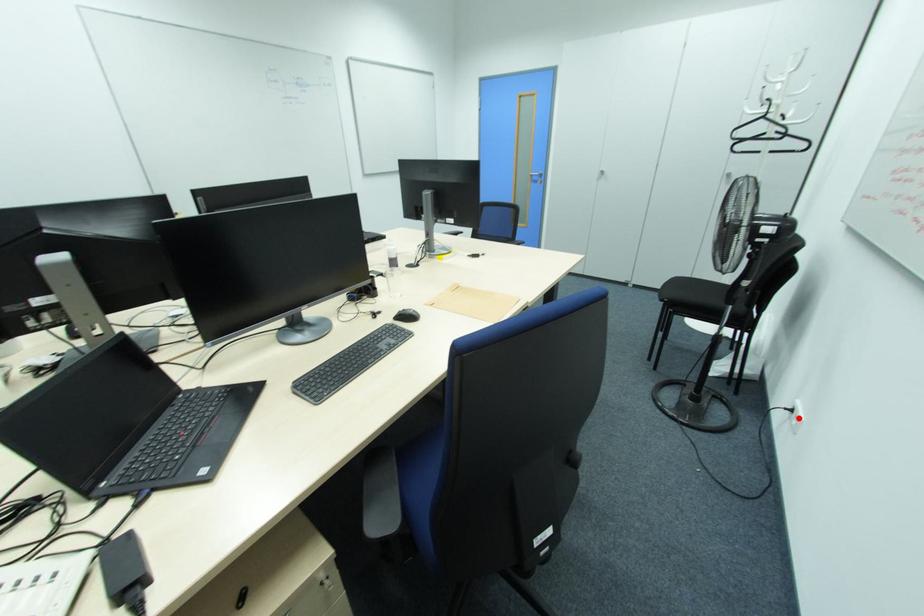
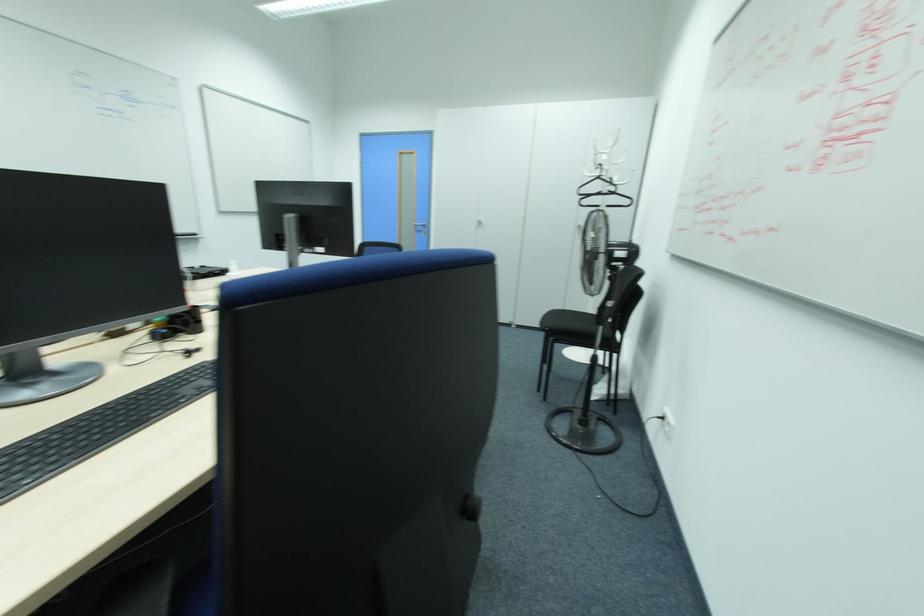
Question: I am providing you with two images of the same scene from different viewpoints. In image1, a red point is highlighted. Considering the same 3D point in image2, which of the following is correct?

Choices:
 (A) It is closer
 (B) It is farther

Answer: (A)